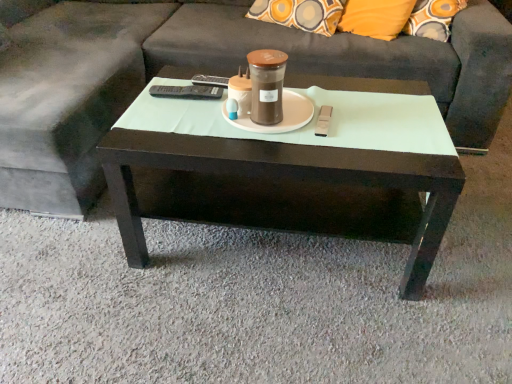
Identify the location of vacant area that is situated to the right of brown matte jar at center. The height and width of the screenshot is (384, 512). (x=341, y=122).